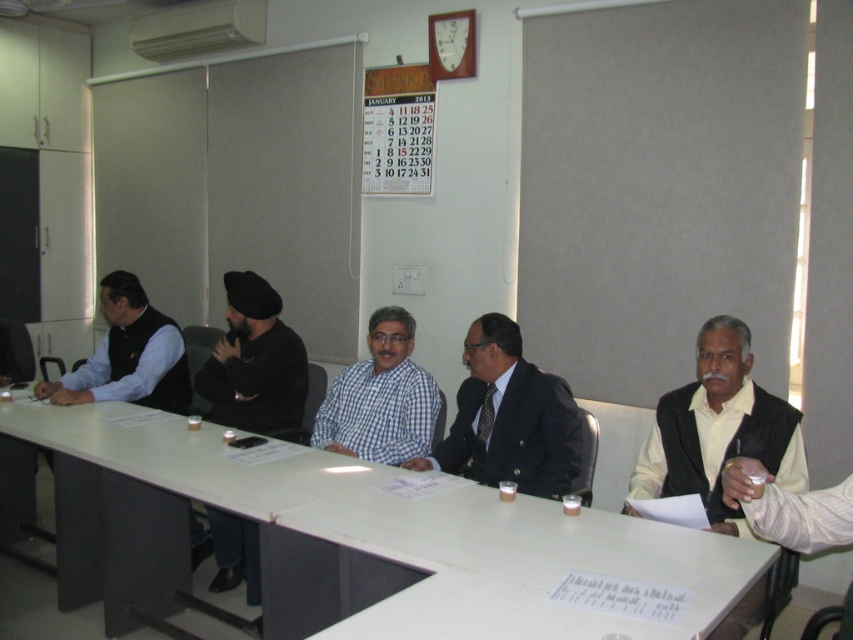
You are standing in the conference room and want to reach the point at coordinates point [679,470]. The table is 2 meters long. Can you walk around the table to reach it?

The point [679,470] is 2.62 meters away from the camera. Since the table is only 2 meters long, you can walk around the table to reach the point as the distance allows for maneuvering around the table.

You are a conference organizer who needs to place a 16 inch wide laptop between the matte black vest at right and the dark blue suit at center. Based on the scene description, will the laptop fit between them?

The distance between the matte black vest at right and the dark blue suit at center is 18.60 inches. Since the laptop is 16 inches wide, it will fit comfortably between them with some space to spare.

You are organizing a photo shoot and need to arrange two outfits for a catalog. You have the matte black vest at right and the blue checkered shirt at center. Based on their sizes, which one should you place in the foreground to emphasize its prominence?

The matte black vest at right is bigger than the blue checkered shirt at center, so placing it in the foreground would emphasize its prominence due to its larger size.